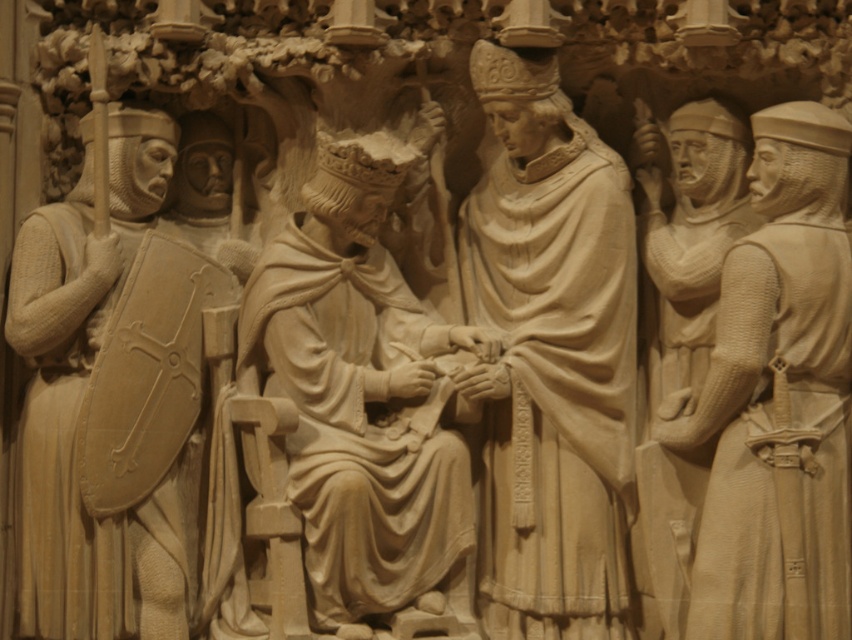
Question: From the image, what is the correct spatial relationship of beige stone king at center in relation to beige stone soldiers at right?

Choices:
 (A) below
 (B) above

Answer: (A)

Question: Where is beige stone robe at center located in relation to beige stone knight at left in the image?

Choices:
 (A) below
 (B) above

Answer: (B)

Question: Is beige stone king at center smaller than beige stone knight at left?

Choices:
 (A) yes
 (B) no

Answer: (B)

Question: Which object is closer to the camera taking this photo?

Choices:
 (A) beige stone robe at center
 (B) beige stone king at center
 (C) beige stone soldiers at right

Answer: (C)

Question: Which of the following is the farthest from the observer?

Choices:
 (A) beige stone soldiers at right
 (B) beige stone knight at left
 (C) beige stone robe at center

Answer: (C)

Question: Which object is positioned closest to the beige stone soldiers at right?

Choices:
 (A) beige stone knight at left
 (B) beige stone robe at center

Answer: (B)